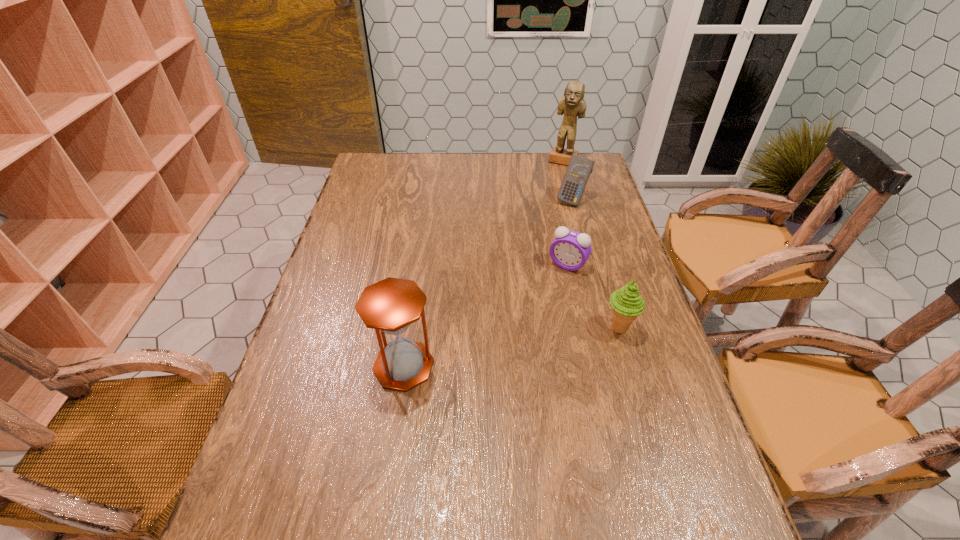
This screenshot has width=960, height=540. In order to click on free space on the desktop that is between the fourth shortest object and the icecream and is positioned on the front-facing side of the second farthest object in this screenshot , I will do `click(497, 349)`.

You are a GUI agent. You are given a task and a screenshot of the screen. Output one action in this format:
    pyautogui.click(x=<x>, y=<y>)
    Task: Click on the free space on the desktop that is between the nearest object and the icecream and is positioned on the front-facing side of the farthest object
    Image resolution: width=960 pixels, height=540 pixels.
    Given the screenshot: What is the action you would take?
    pyautogui.click(x=496, y=349)

At what (x,y) coordinates should I click in order to perform the action: click on vacant space on the desktop that is between the leftmost object and the fourth farthest object and is positioned on the face of the third farthest object. Please return your answer as a coordinate pair (x, y). The image size is (960, 540). Looking at the image, I should click on (515, 346).